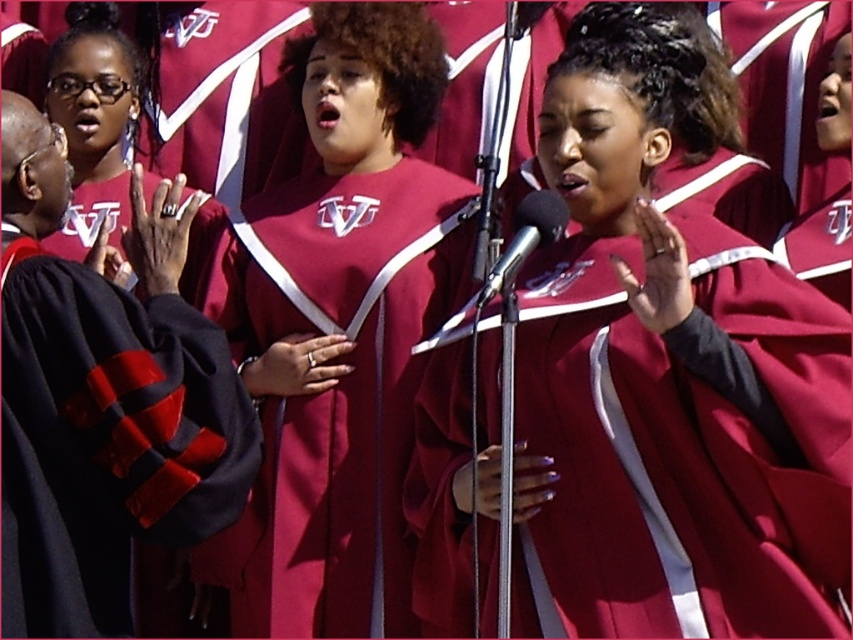
You are standing at the entrance of the venue and want to find the maroon satin robe at center. According to the spatial coordinates provided, in which direction should you move to locate it?

The maroon satin robe at center is located at coordinates point (334, 392), which means it is positioned to the right and slightly above your current viewpoint. Move towards the right side of the venue to find it.

Based on the scene description, which object is taller between the maroon fabric choir robe at center and the velvet black graduation gown at left?

The maroon fabric choir robe at center is taller than the velvet black graduation gown at left.